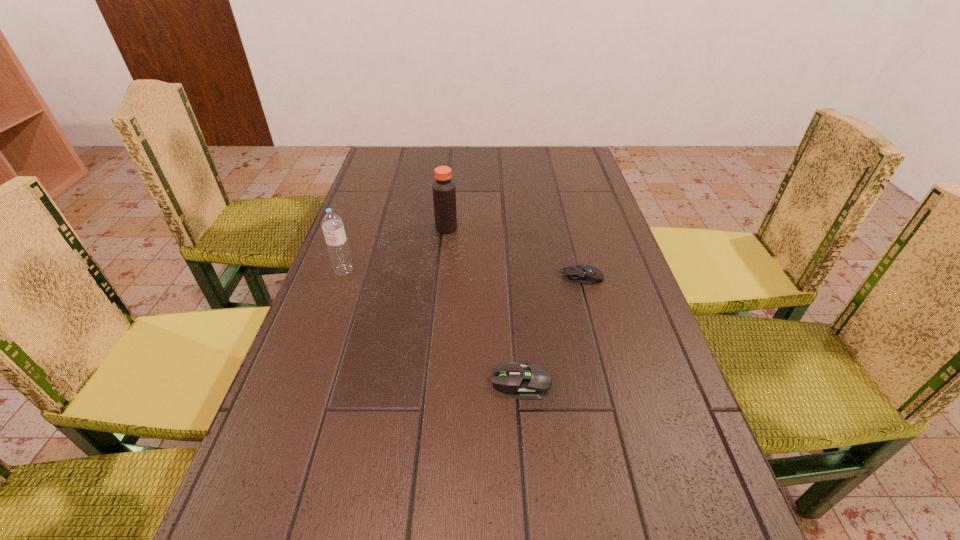
The image size is (960, 540). In order to click on vacant position located on the back of the nearer computer mouse in this screenshot , I will do `click(512, 276)`.

Identify the location of object situated at the left edge. (332, 224).

This screenshot has height=540, width=960. What are the coordinates of `object present at the right edge` in the screenshot? It's located at (582, 273).

The width and height of the screenshot is (960, 540). In the image, there is a desktop. Identify the location of vacant space at the far edge. (477, 163).

Find the location of a particular element. vacant area at the left edge is located at coordinates (391, 286).

In the image, there is a desktop. Where is `vacant space at the right edge`? vacant space at the right edge is located at coordinates (612, 246).

This screenshot has height=540, width=960. In the image, there is a desktop. Identify the location of free space at the far left corner. (386, 167).

Identify the location of free space between the water bottle and the nearest object. (432, 326).

Find the location of `vacant region between the nearest object and the vinegar`. vacant region between the nearest object and the vinegar is located at coordinates (484, 305).

The width and height of the screenshot is (960, 540). Find the location of `vacant space that is in between the leftmost object and the nearest object`. vacant space that is in between the leftmost object and the nearest object is located at coordinates (432, 326).